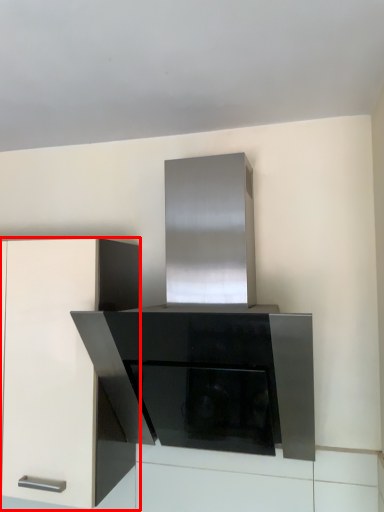
Question: Where is cabinetry (annotated by the red box) located in relation to appliance in the image?

Choices:
 (A) left
 (B) right

Answer: (A)